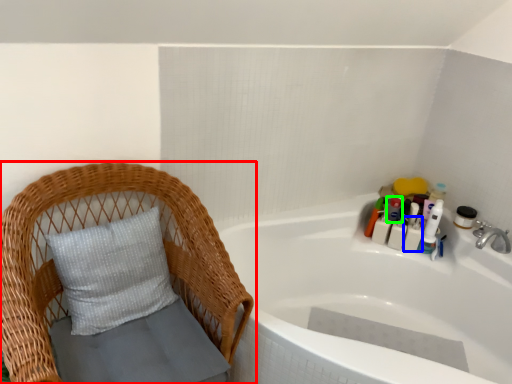
Question: Based on their relative distances, which object is farther from furniture (highlighted by a red box)? Choose from toiletry (highlighted by a blue box) and toiletry (highlighted by a green box).

Choices:
 (A) toiletry
 (B) toiletry

Answer: (A)